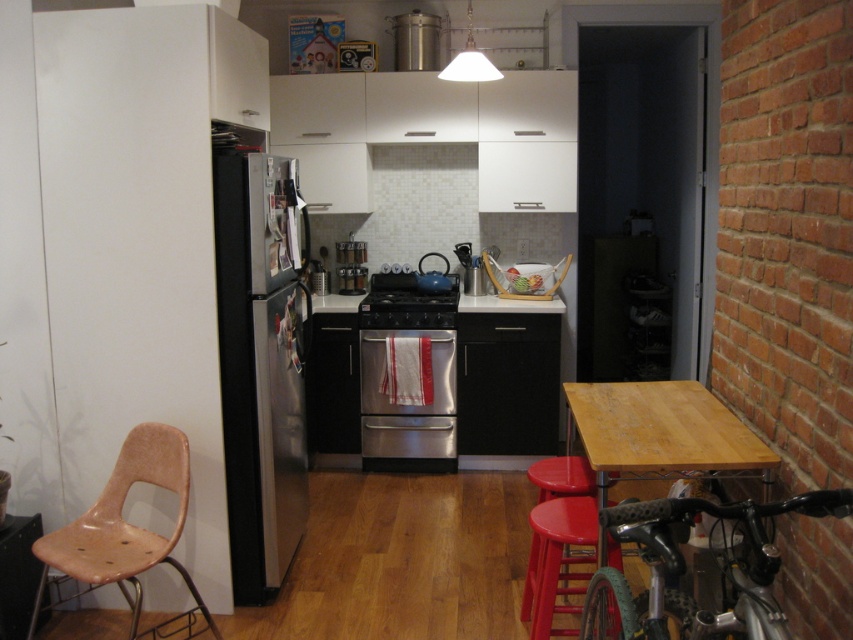
Question: Which point is closer to the camera taking this photo?

Choices:
 (A) (730, 552)
 (B) (543, 595)

Answer: (A)

Question: Estimate the real-world distances between objects in this image. Which object is farther from the satin stainless steel refrigerator at left?

Choices:
 (A) brown matte chair at left
 (B) red plastic stool at lower right
 (C) wooden table at right

Answer: (C)

Question: Is satin stainless steel refrigerator at left behind teal matte kettle at center?

Choices:
 (A) yes
 (B) no

Answer: (B)

Question: Can you confirm if silver metallic bicycle at lower right is positioned above stainless steel stove at center?

Choices:
 (A) yes
 (B) no

Answer: (B)

Question: Can you confirm if silver metallic bicycle at lower right is positioned below wooden table at right?

Choices:
 (A) no
 (B) yes

Answer: (B)

Question: Which object is closer to the camera taking this photo?

Choices:
 (A) satin stainless steel refrigerator at left
 (B) red plastic stool at lower right
 (C) stainless steel stove at center
 (D) brown matte chair at left

Answer: (B)